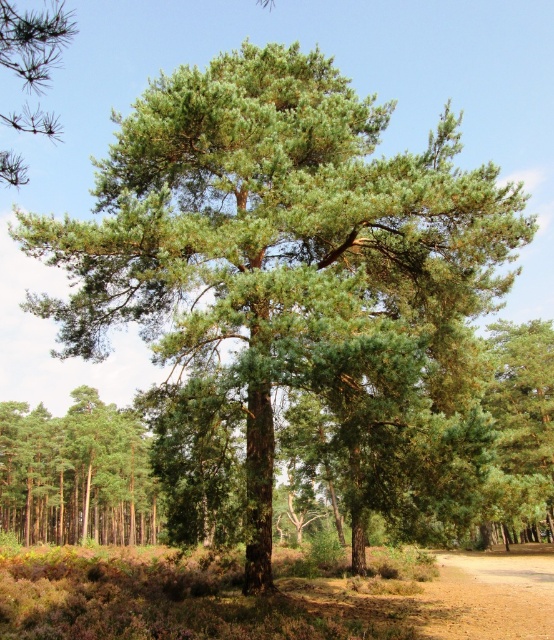
Does point (125, 480) lie behind point (28, 38)?

Yes, point (125, 480) is farther from viewer.

Is green smooth tree at left thinner than green needle-like at upper left?

Yes.

What do you see at coordinates (75, 474) in the screenshot?
I see `green smooth tree at left` at bounding box center [75, 474].

Identify the location of green smooth tree at left. (75, 474).

Who is positioned more to the right, green smooth tree at left or dirt path at lower right?

dirt path at lower right

Is point (86, 460) behind point (474, 614)?

Yes.

The width and height of the screenshot is (554, 640). Find the location of `green smooth tree at left`. green smooth tree at left is located at coordinates (75, 474).

Is dirt path at lower right thinner than green needle-like at upper left?

Correct, dirt path at lower right's width is less than green needle-like at upper left's.

Who is taller, dirt path at lower right or green needle-like at upper left?

Standing taller between the two is green needle-like at upper left.

Is point (521, 595) in front of point (7, 51)?

That is False.

You are a GUI agent. You are given a task and a screenshot of the screen. Output one action in this format:
    pyautogui.click(x=<x>, y=<y>)
    Task: Click on the dirt path at lower right
    
    Given the screenshot: What is the action you would take?
    pyautogui.click(x=490, y=596)